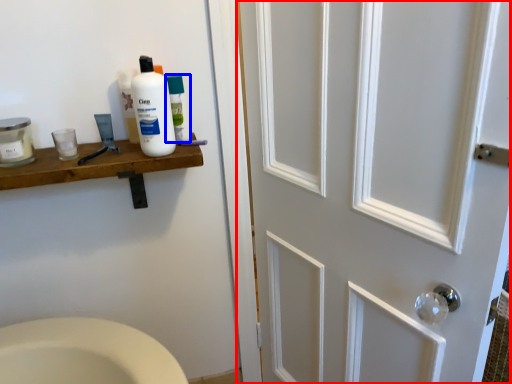
Question: Among these objects, which one is nearest to the camera, door (highlighted by a red box) or mouthwash (highlighted by a blue box)?

Choices:
 (A) door
 (B) mouthwash

Answer: (A)